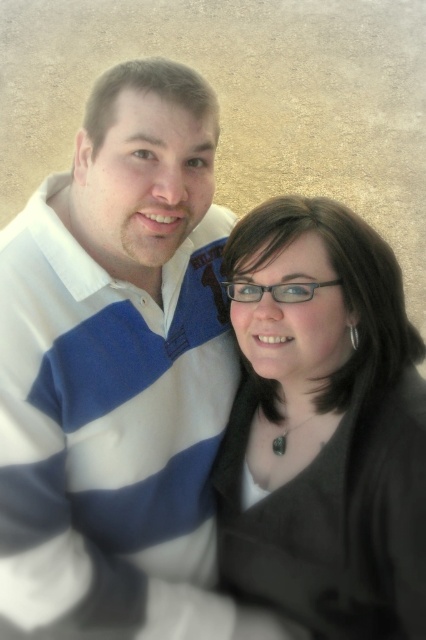
You are a photographer trying to capture a closeup of the black matte glasses at center while ensuring the white striped sweater at left is still visible in the frame. Given their sizes, which object should you focus on first to ensure both are in focus?

The white striped sweater at left is bigger than the black matte glasses at center, so you should focus on the white striped sweater at left first to ensure both are in focus since larger objects require more depth of field to be sharp.

You are taking a photo of two people standing in front of you. You notice two specific points in the image labeled as point (152, 429) and point (284, 308). Which point is closer to you?

Point (152, 429) is closer to you than point (284, 308) because it is further to the viewer.

You are taking a photo of two people standing side by side. You notice the white striped sweater at left and the black matte glasses at center. Which object takes up more horizontal space in the photo?

The white striped sweater at left takes up more horizontal space than the black matte glasses at center because its width surpasses the glasses.